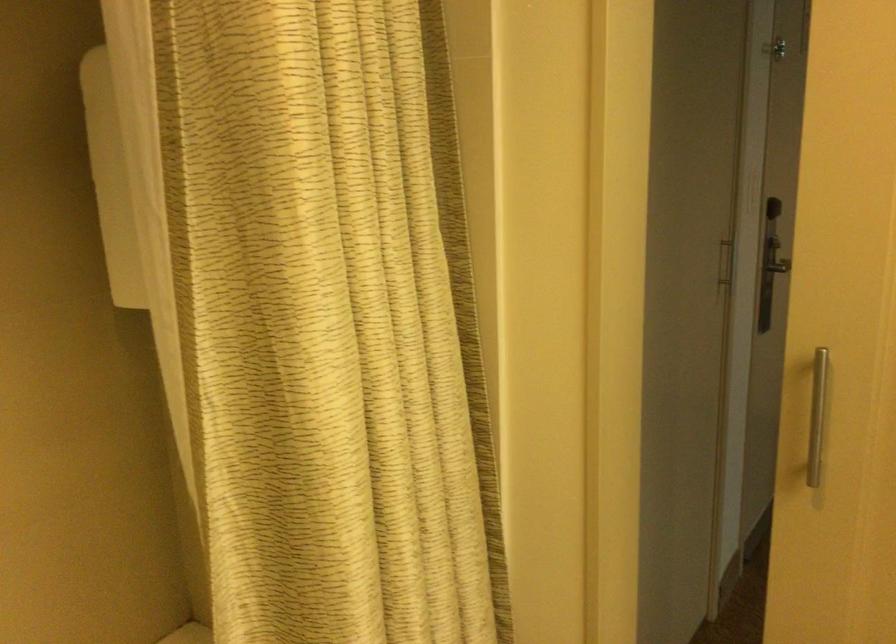
At what (x,y) coordinates should I click in order to perform the action: click on silver cabinet handle. Please return your answer as a coordinate pair (x, y). Looking at the image, I should click on (816, 415).